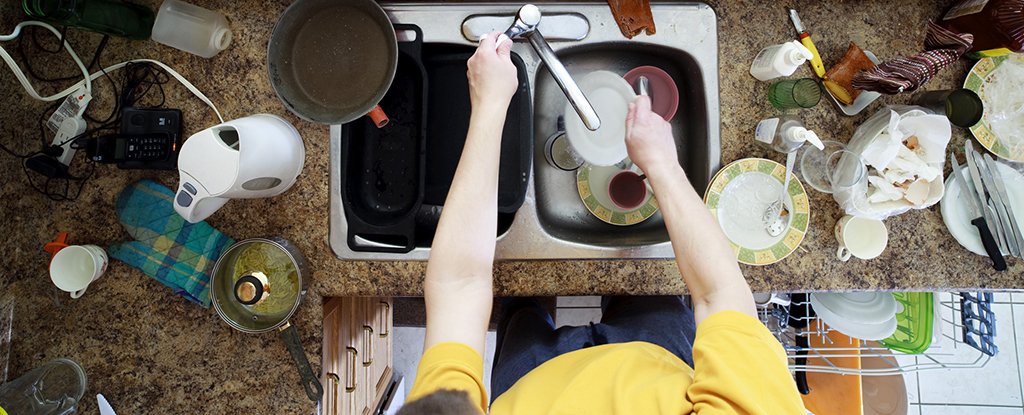
You are a GUI agent. You are given a task and a screenshot of the screen. Output one action in this format:
    pyautogui.click(x=<x>, y=<y>)
    Task: Click on the faucet
    
    Given the screenshot: What is the action you would take?
    pyautogui.click(x=579, y=101), pyautogui.click(x=552, y=21)